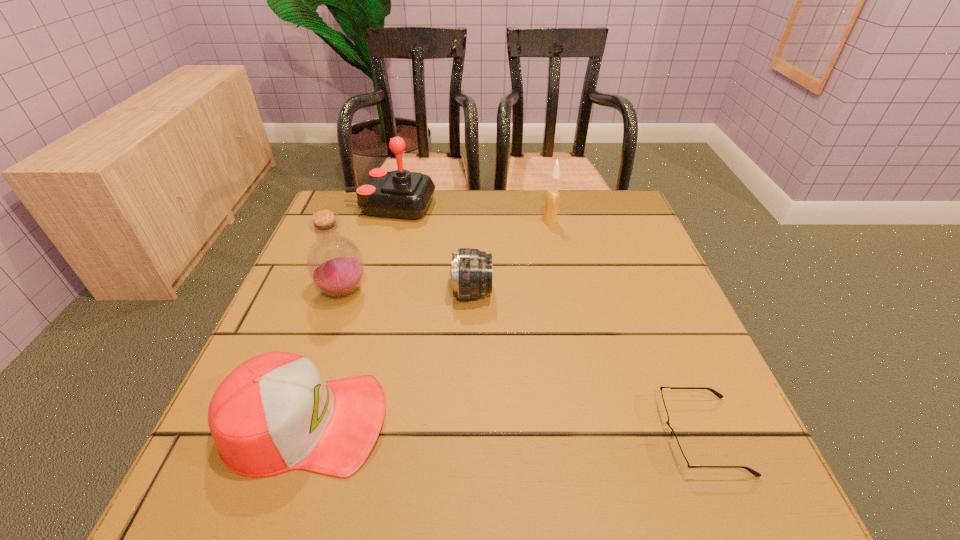
Identify the location of vacant space located 0.380m on the front-facing side of the baseball cap. (623, 422).

The image size is (960, 540). In order to click on free region located at the front element of the fourth object from left to right in this screenshot , I will do `click(557, 292)`.

Where is `vacant position located on the front-facing side of the spectacles`? This screenshot has width=960, height=540. vacant position located on the front-facing side of the spectacles is located at coordinates (420, 435).

You are a GUI agent. You are given a task and a screenshot of the screen. Output one action in this format:
    pyautogui.click(x=<x>, y=<y>)
    Task: Click on the blank space located on the front-facing side of the spectacles
    
    Given the screenshot: What is the action you would take?
    pyautogui.click(x=581, y=435)

This screenshot has width=960, height=540. In order to click on free space located on the front-facing side of the spectacles in this screenshot , I will do `click(408, 435)`.

Where is `joystick located in the far edge section of the desktop`? joystick located in the far edge section of the desktop is located at coordinates (403, 194).

Find the location of `candle at the far edge`. candle at the far edge is located at coordinates (552, 196).

Where is `baseball cap located in the near edge section of the desktop`? baseball cap located in the near edge section of the desktop is located at coordinates (274, 413).

The height and width of the screenshot is (540, 960). I want to click on spectacles present at the near edge, so click(x=677, y=452).

Where is `joystick that is at the left edge`? joystick that is at the left edge is located at coordinates (403, 194).